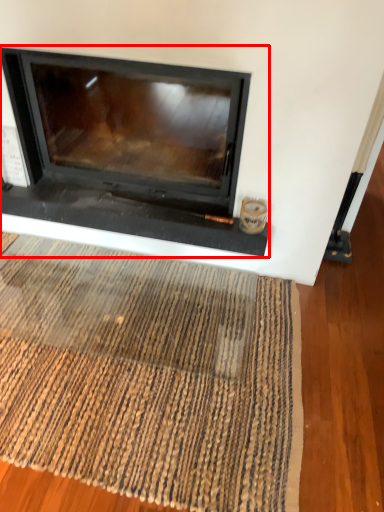
Question: In this image, where is fireplace (annotated by the red box) located relative to mat?

Choices:
 (A) left
 (B) right

Answer: (B)